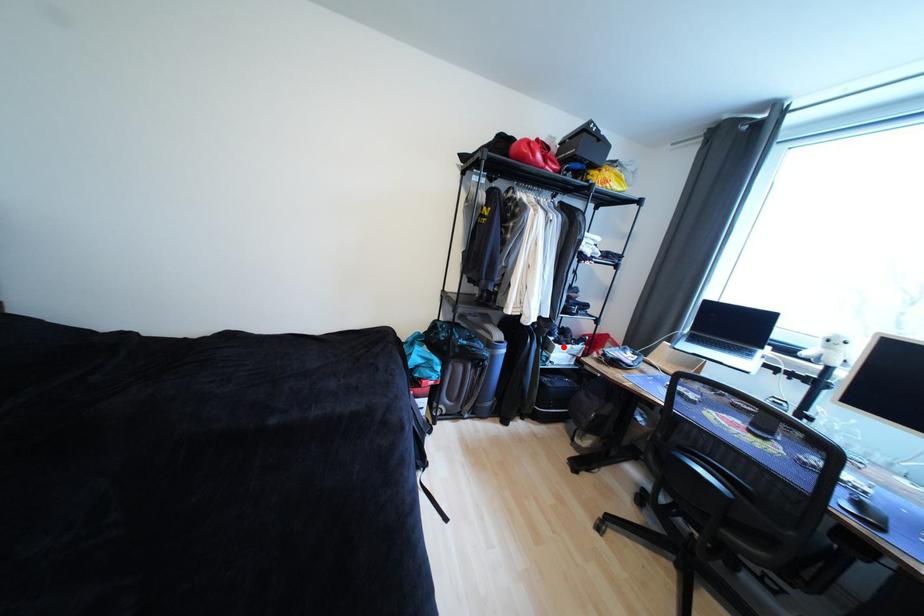
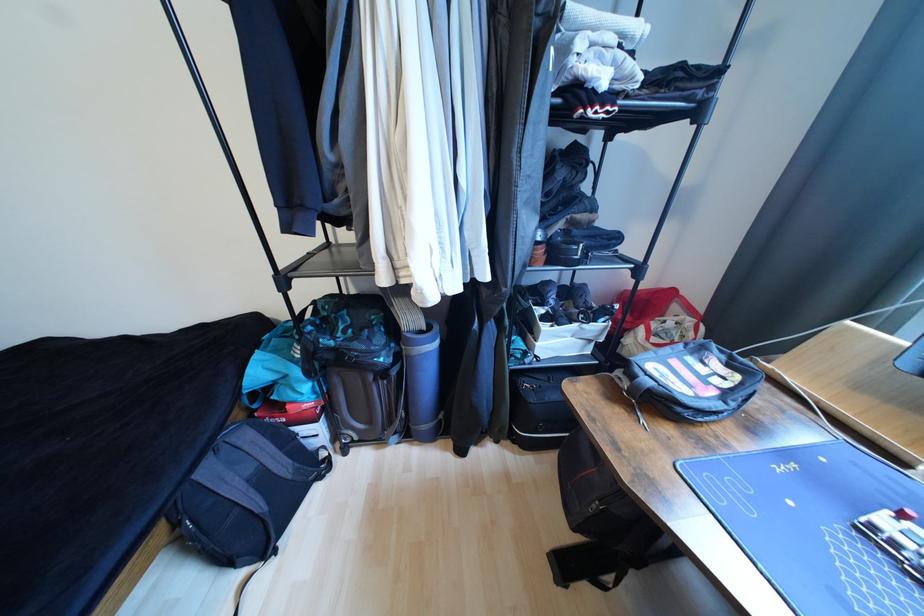
Question: I am providing you with two images of the same scene from different viewpoints. A red point is shown in image1. For the corresponding object point in image2, is it positioned nearer or farther from the camera?

Choices:
 (A) Nearer
 (B) Farther

Answer: (A)